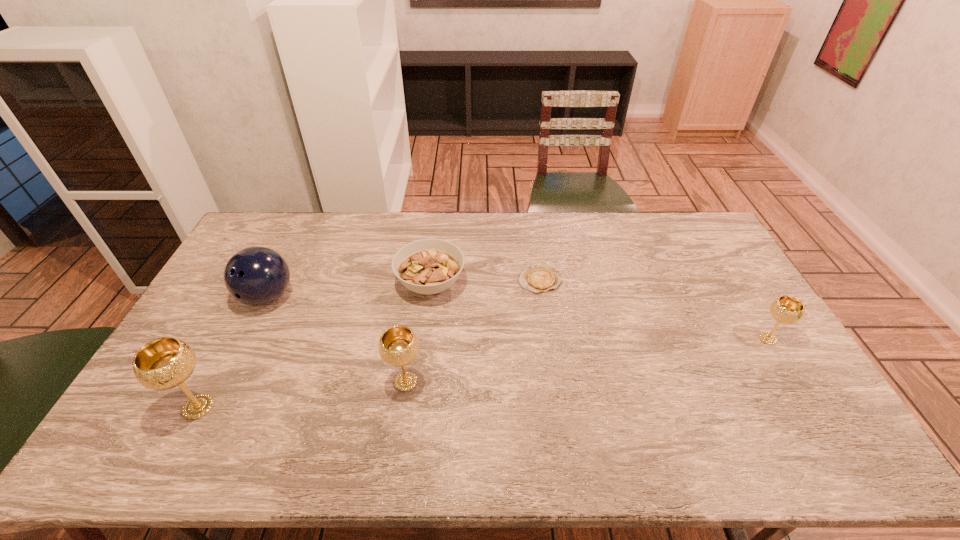
This screenshot has width=960, height=540. In the image, there is a desktop. In order to click on free space at the near edge in this screenshot , I will do `click(383, 396)`.

Locate an element on the screen. This screenshot has height=540, width=960. vacant space at the right edge is located at coordinates (730, 294).

This screenshot has width=960, height=540. In the image, there is a desktop. In order to click on vacant space at the far right corner in this screenshot , I will do `click(705, 225)`.

This screenshot has height=540, width=960. Identify the location of vacant region between the second shortest chalice and the tallest chalice. (302, 394).

Where is `free point between the fifth tallest object and the third shortest object`? free point between the fifth tallest object and the third shortest object is located at coordinates (599, 311).

Image resolution: width=960 pixels, height=540 pixels. What are the coordinates of `vacant space in between the stew and the shortest chalice` in the screenshot? It's located at (599, 311).

At what (x,y) coordinates should I click in order to perform the action: click on free space between the farthest chalice and the second chalice from right to left. Please return your answer as a coordinate pair (x, y). Looking at the image, I should click on (587, 360).

At what (x,y) coordinates should I click in order to perform the action: click on vacant area that lies between the stew and the second shortest chalice. Please return your answer as a coordinate pair (x, y). Looking at the image, I should click on (419, 333).

Find the location of a particular element. This screenshot has height=540, width=960. free area in between the tallest object and the third shortest object is located at coordinates (483, 373).

The width and height of the screenshot is (960, 540). I want to click on vacant point located between the farthest chalice and the tallest chalice, so click(483, 373).